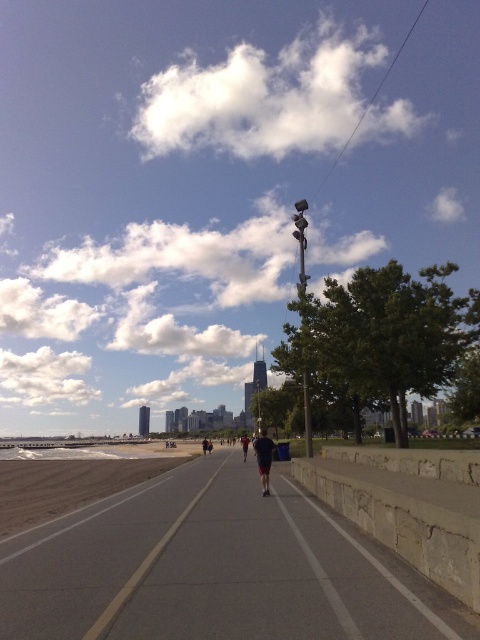
Does gray concrete bike path at center appear on the right side of dark gray fabric shorts at center?

Incorrect, gray concrete bike path at center is not on the right side of dark gray fabric shorts at center.

Does gray concrete bike path at center come in front of dark gray fabric shorts at center?

Yes, it is.

Identify the location of gray concrete bike path at center. The image size is (480, 640). (215, 568).

Identify the location of gray concrete bike path at center. 215,568.